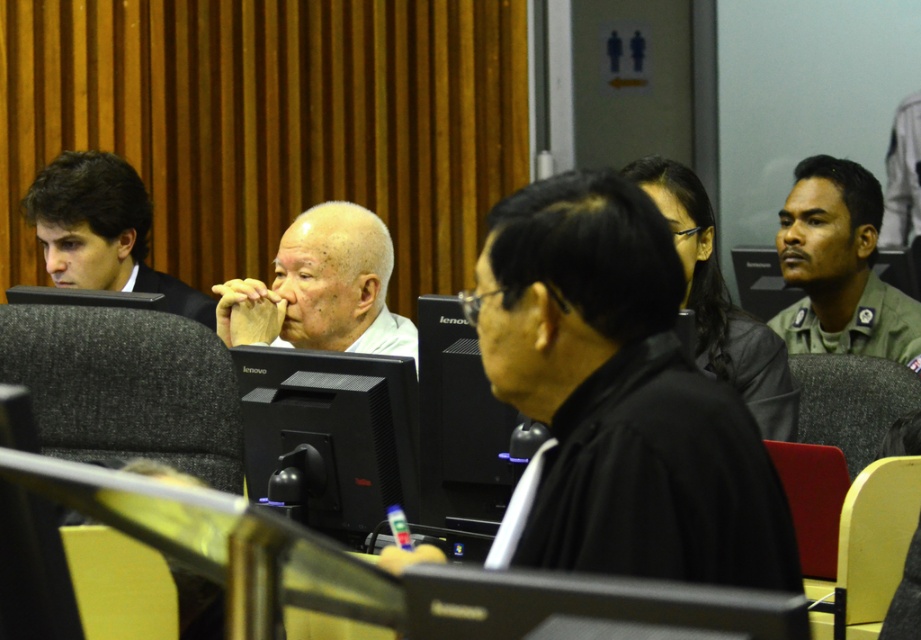
Question: Which point is closer to the camera?

Choices:
 (A) click(x=787, y=195)
 (B) click(x=122, y=176)
 (C) click(x=283, y=492)

Answer: (C)

Question: Does white matte bald head at center have a lesser width compared to dark brown hair at left?

Choices:
 (A) yes
 (B) no

Answer: (A)

Question: From the image, what is the correct spatial relationship of black matte monitor at center in relation to green uniform at right?

Choices:
 (A) left
 (B) right

Answer: (A)

Question: Which point is farther from the camera taking this photo?

Choices:
 (A) pyautogui.click(x=322, y=369)
 (B) pyautogui.click(x=310, y=230)

Answer: (B)

Question: Which object is the farthest from the white matte bald head at center?

Choices:
 (A) black matte monitor at center
 (B) black matte robe at center
 (C) dark brown hair at left

Answer: (B)

Question: Does white matte bald head at center have a larger size compared to dark brown hair at left?

Choices:
 (A) no
 (B) yes

Answer: (A)